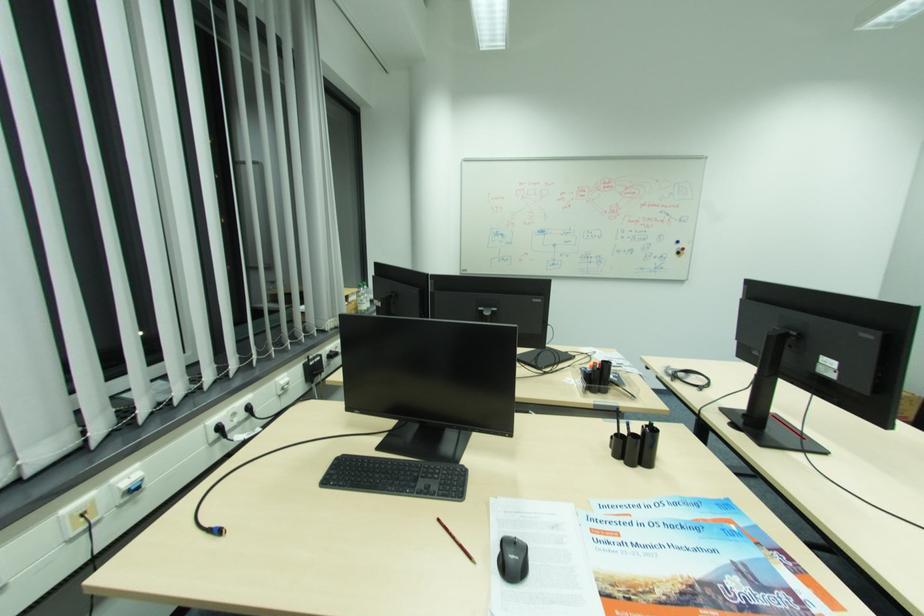
Where is `red whiteboard marker`? red whiteboard marker is located at coordinates (679, 251).